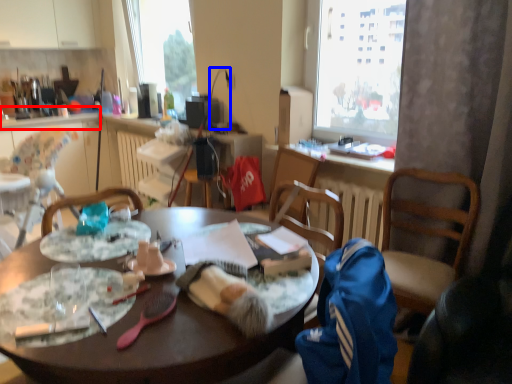
Question: Which of the following is the closest to the observer, counter top (highlighted by a red box) or lamp (highlighted by a blue box)?

Choices:
 (A) counter top
 (B) lamp

Answer: (B)